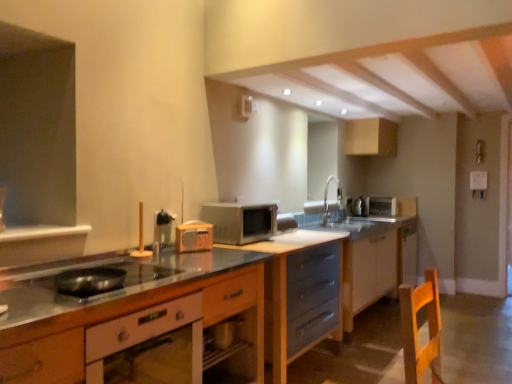
Question: Is point (403, 248) positioned closer to the camera than point (246, 215)?

Choices:
 (A) closer
 (B) farther

Answer: (B)

Question: Based on their sizes in the image, would you say matte gray drawers at center, the third cabinetry when ordered from back to front, is bigger or smaller than satin silver microwave at center?

Choices:
 (A) big
 (B) small

Answer: (A)

Question: Estimate the real-world distances between objects in this image. Which object is farther from the metallic silver microwave at center, which ranks as the 3th appliance in left-to-right order?

Choices:
 (A) matte wood cabinet at center, the 1th cabinetry positioned from the front
 (B) silver metallic faucet at upper center
 (C) white glossy cabinet at lower right, which is the 4th cabinetry in front-to-back order
 (D) satin silver toaster at upper center, marked as the 2th appliance in a front-to-back arrangement
 (E) matte black exhaust hood at upper left

Answer: (A)

Question: Which is nearer to the silver metallic faucet at upper center?

Choices:
 (A) matte black exhaust hood at upper left
 (B) metallic silver microwave at center, positioned as the 1th appliance in right-to-left order
 (C) matte gray drawers at center, the 4th cabinetry in the back-to-front sequence
 (D) wooden radio at center, the 1th appliance viewed from the left
 (E) satin silver microwave at center

Answer: (B)